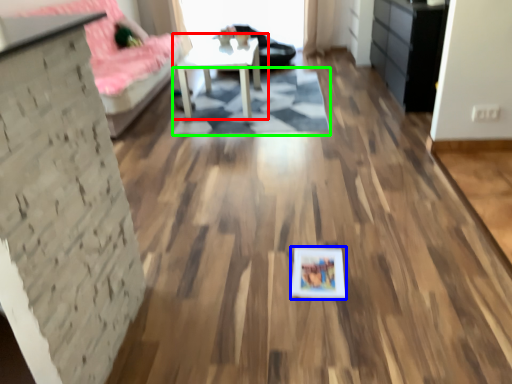
Question: Estimate the real-world distances between objects in this image. Which object is closer to table (highlighted by a red box), picture frame (highlighted by a blue box) or mat (highlighted by a green box)?

Choices:
 (A) picture frame
 (B) mat

Answer: (B)